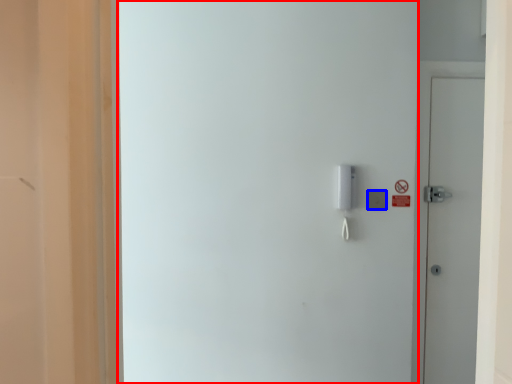
Question: Which object is closer to the camera taking this photo, screen door (highlighted by a red box) or light switch (highlighted by a blue box)?

Choices:
 (A) screen door
 (B) light switch

Answer: (A)